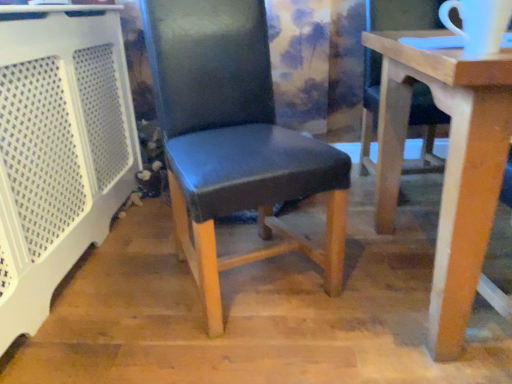
Question: Considering the relative sizes of black leather chair at center, placed as the second chair when sorted from right to left, and matte black chair at center, the second chair when ordered from left to right, in the image provided, is black leather chair at center, placed as the second chair when sorted from right to left, shorter than matte black chair at center, the second chair when ordered from left to right,?

Choices:
 (A) no
 (B) yes

Answer: (A)

Question: Is black leather chair at center, placed as the second chair when sorted from right to left, aimed at matte black chair at center, the second chair when ordered from left to right?

Choices:
 (A) no
 (B) yes

Answer: (A)

Question: From the image's perspective, is black leather chair at center, placed as the second chair when sorted from right to left, under matte black chair at center, the second chair when ordered from left to right?

Choices:
 (A) no
 (B) yes

Answer: (A)

Question: Considering the relative sizes of black leather chair at center, marked as the first chair in a left-to-right arrangement, and matte black chair at center, the second chair when ordered from left to right, in the image provided, is black leather chair at center, marked as the first chair in a left-to-right arrangement, bigger than matte black chair at center, the second chair when ordered from left to right,?

Choices:
 (A) no
 (B) yes

Answer: (A)

Question: From the image's perspective, is black leather chair at center, placed as the second chair when sorted from right to left, on matte black chair at center, acting as the first chair starting from the right?

Choices:
 (A) yes
 (B) no

Answer: (A)

Question: From a real-world perspective, is matte black chair at center, acting as the first chair starting from the right, above or below black leather chair at center, placed as the second chair when sorted from right to left?

Choices:
 (A) above
 (B) below

Answer: (B)

Question: Would you say matte black chair at center, the second chair when ordered from left to right, is to the left or to the right of black leather chair at center, placed as the second chair when sorted from right to left, in the picture?

Choices:
 (A) right
 (B) left

Answer: (A)

Question: From the image's perspective, is matte black chair at center, the second chair when ordered from left to right, positioned above or below black leather chair at center, marked as the first chair in a left-to-right arrangement?

Choices:
 (A) above
 (B) below

Answer: (B)

Question: Is matte black chair at center, the second chair when ordered from left to right, wider or thinner than black leather chair at center, marked as the first chair in a left-to-right arrangement?

Choices:
 (A) wide
 (B) thin

Answer: (A)

Question: Is black leather chair at center, marked as the first chair in a left-to-right arrangement, wider or thinner than white perforated plastic at left?

Choices:
 (A) wide
 (B) thin

Answer: (A)

Question: Is black leather chair at center, marked as the first chair in a left-to-right arrangement, inside the boundaries of white perforated plastic at left, or outside?

Choices:
 (A) inside
 (B) outside

Answer: (B)

Question: Considering the relative positions of black leather chair at center, placed as the second chair when sorted from right to left, and white perforated plastic at left in the image provided, is black leather chair at center, placed as the second chair when sorted from right to left, to the left or to the right of white perforated plastic at left?

Choices:
 (A) left
 (B) right

Answer: (B)

Question: Is black leather chair at center, marked as the first chair in a left-to-right arrangement, taller or shorter than white perforated plastic at left?

Choices:
 (A) short
 (B) tall

Answer: (B)

Question: Considering the relative positions of white perforated plastic at left and black leather chair at center, placed as the second chair when sorted from right to left, in the image provided, is white perforated plastic at left to the left or to the right of black leather chair at center, placed as the second chair when sorted from right to left,?

Choices:
 (A) left
 (B) right

Answer: (A)

Question: In terms of height, does white perforated plastic at left look taller or shorter compared to black leather chair at center, placed as the second chair when sorted from right to left?

Choices:
 (A) short
 (B) tall

Answer: (A)